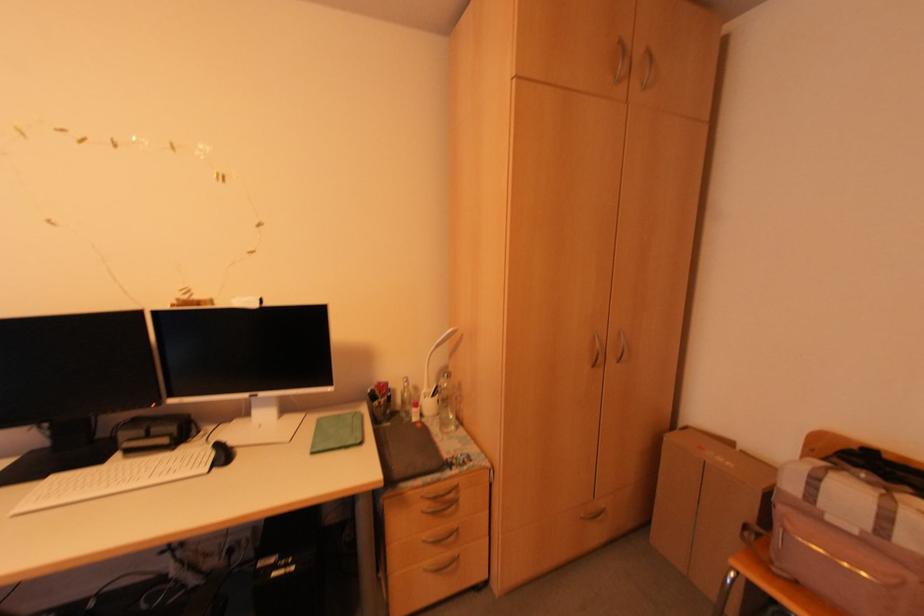
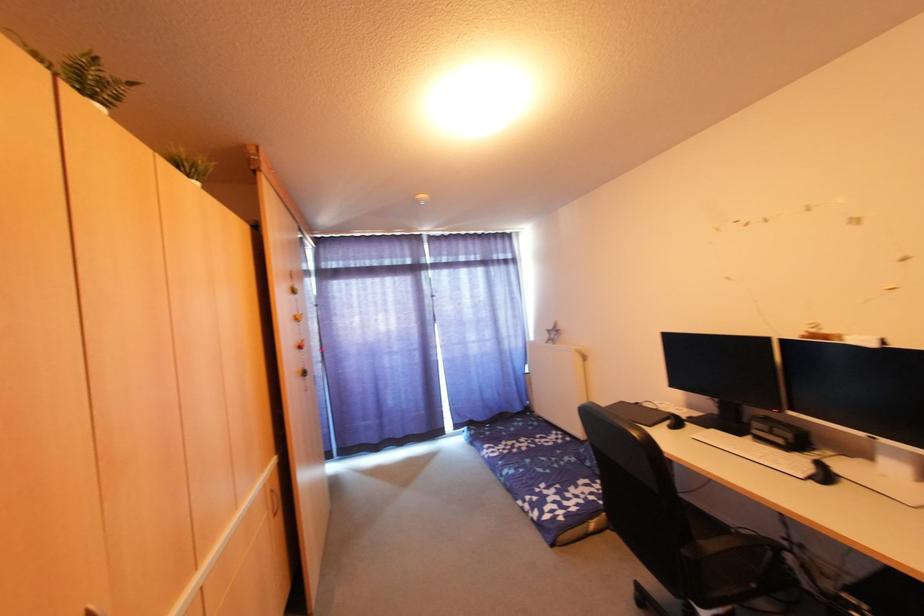
Question: How did the camera likely rotate?

Choices:
 (A) Left
 (B) Right
 (C) Up
 (D) Down

Answer: (A)